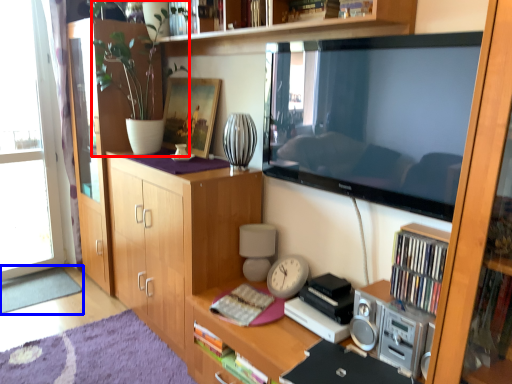
Question: Which object appears farthest to the camera in this image, houseplant (highlighted by a red box) or plain (highlighted by a blue box)?

Choices:
 (A) houseplant
 (B) plain

Answer: (B)